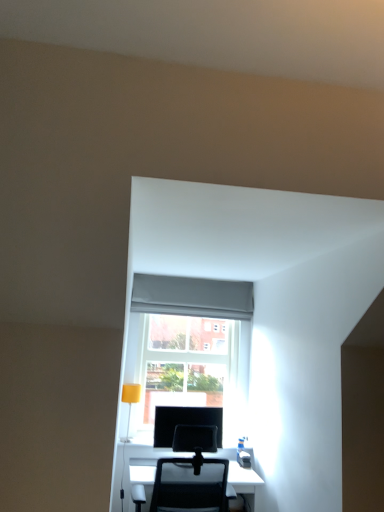
Question: Can you confirm if transparent glass door at center is wider than matte black monitor at center?

Choices:
 (A) yes
 (B) no

Answer: (A)

Question: From a real-world perspective, does transparent glass door at center stand above matte black monitor at center?

Choices:
 (A) no
 (B) yes

Answer: (B)

Question: From a real-world perspective, does transparent glass door at center sit lower than matte black monitor at center?

Choices:
 (A) yes
 (B) no

Answer: (B)

Question: Is transparent glass door at center positioned with its back to matte black monitor at center?

Choices:
 (A) yes
 (B) no

Answer: (B)

Question: Can you confirm if transparent glass door at center is bigger than matte black monitor at center?

Choices:
 (A) yes
 (B) no

Answer: (A)

Question: Does transparent glass door at center come behind matte black monitor at center?

Choices:
 (A) no
 (B) yes

Answer: (B)

Question: Would you say matte black monitor at center is outside transparent glass door at center?

Choices:
 (A) no
 (B) yes

Answer: (B)

Question: Is matte black monitor at center to the right of transparent glass door at center from the viewer's perspective?

Choices:
 (A) no
 (B) yes

Answer: (B)

Question: Is matte black monitor at center oriented towards transparent glass door at center?

Choices:
 (A) yes
 (B) no

Answer: (B)

Question: Would you consider matte black monitor at center to be distant from transparent glass door at center?

Choices:
 (A) yes
 (B) no

Answer: (B)

Question: Is matte black monitor at center smaller than transparent glass door at center?

Choices:
 (A) no
 (B) yes

Answer: (B)

Question: Is matte black monitor at center oriented away from transparent glass door at center?

Choices:
 (A) yes
 (B) no

Answer: (A)

Question: Does yellow matte table lamp at lower left lie in front of matte black monitor at center?

Choices:
 (A) no
 (B) yes

Answer: (A)